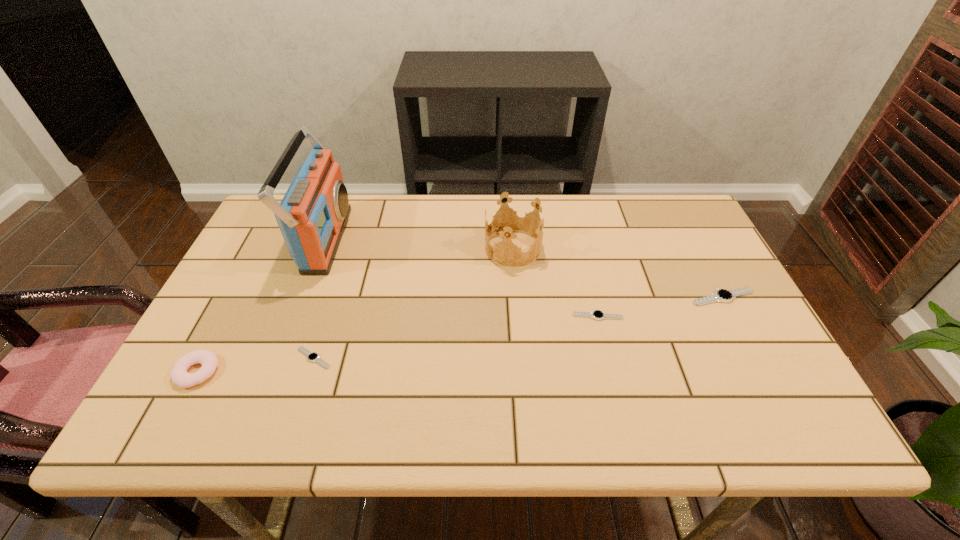
I want to click on the nearest watch, so click(314, 357).

This screenshot has height=540, width=960. Identify the location of the leftmost watch. (314, 357).

Find the location of a particular element. This screenshot has width=960, height=540. the second farthest watch is located at coordinates (597, 314).

This screenshot has width=960, height=540. I want to click on the fifth object from left to right, so click(597, 314).

I want to click on the fourth nearest object, so click(x=721, y=295).

You are a GUI agent. You are given a task and a screenshot of the screen. Output one action in this format:
    pyautogui.click(x=<x>, y=<y>)
    Task: Click on the rightmost object
    The height and width of the screenshot is (540, 960).
    Given the screenshot: What is the action you would take?
    pyautogui.click(x=721, y=295)

The width and height of the screenshot is (960, 540). Find the location of `radio receiver`. radio receiver is located at coordinates (312, 216).

The height and width of the screenshot is (540, 960). What are the coordinates of `the third object from right to left` in the screenshot? It's located at (514, 221).

Find the location of a particular element. the fifth shortest object is located at coordinates (514, 221).

Find the location of a particular element. Image resolution: width=960 pixels, height=540 pixels. the leftmost object is located at coordinates (179, 375).